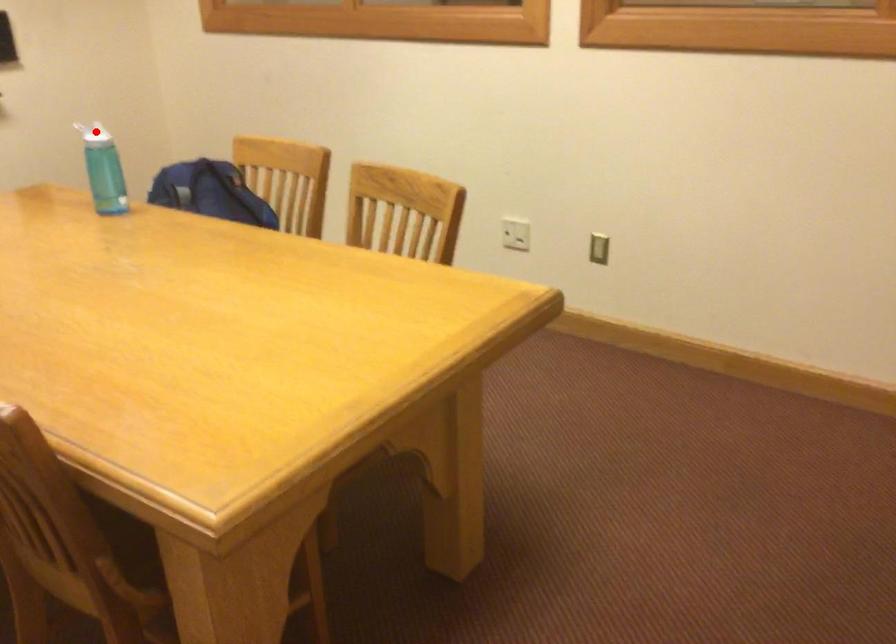
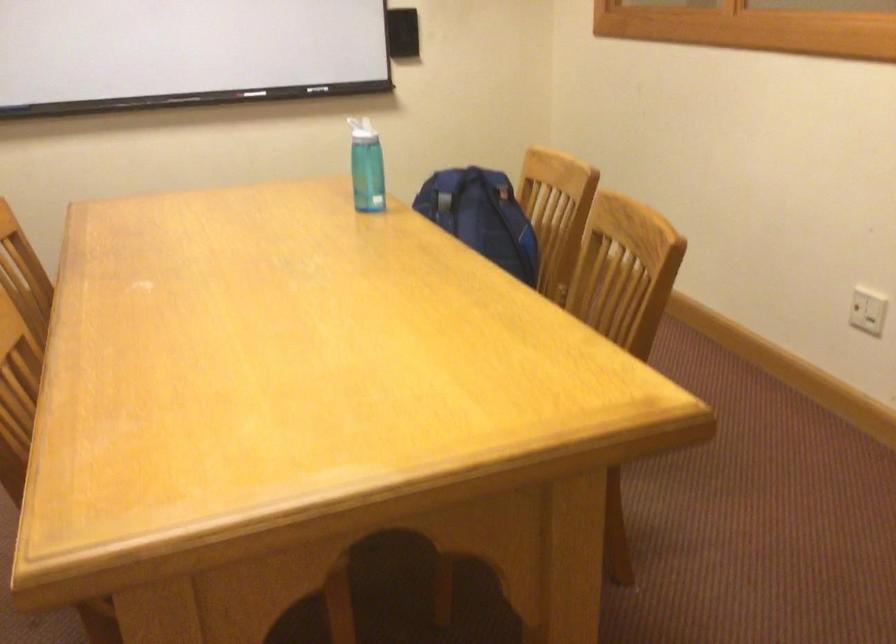
Locate, in the second image, the point that corresponds to the highlighted location in the first image.

(362, 129)